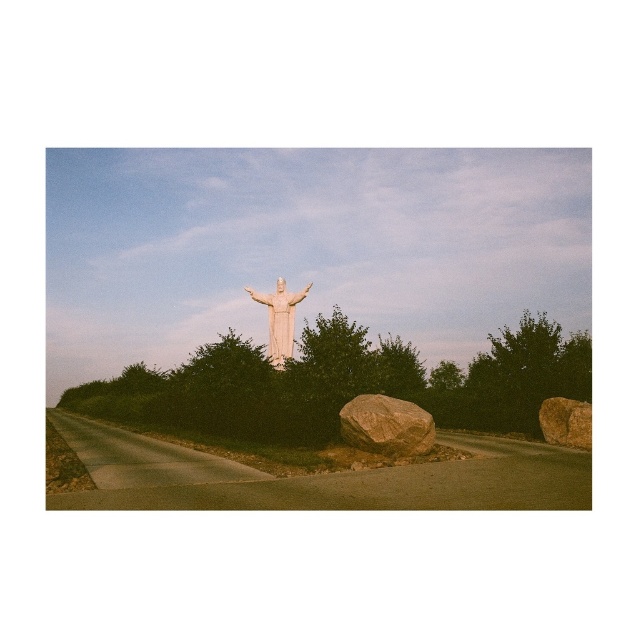
You are standing at the base of the hill looking up towards the statue. There are two brown rough rocks in your view. Which one is closer to you, the brown rough rock at lower center or the brown rough rock at right?

The brown rough rock at lower center is closer to you because it is positioned in front of the brown rough rock at right.

You are a hiker who wants to place a small backpack between the brown rough rock at lower center and the brown rough rock at right. Which rock should you choose to ensure the backpack fits?

The brown rough rock at lower center might be wider than brown rough rock at right, so you should choose the brown rough rock at lower center to place the backpack as it has a wider base to accommodate the backpack.

You are standing at the base of the hill looking up at the statue. There are two points marked on the path leading to the statue. Which of the two points, point (396, 449) or point (293, 307), is closer to the statue?

Point (396, 449) is closer to the statue because it is in front of point (293, 307) along the path.